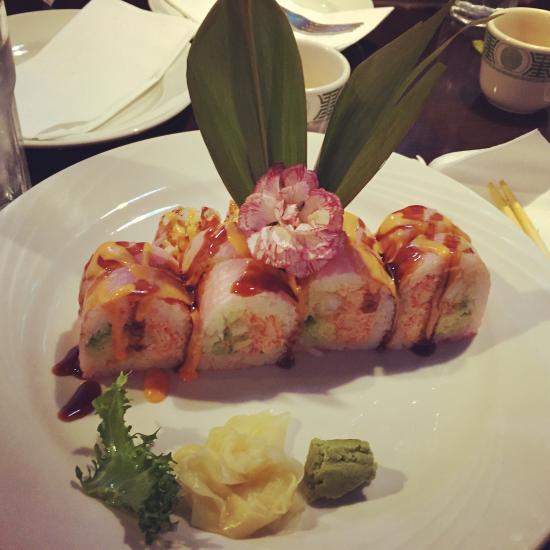
The width and height of the screenshot is (550, 550). Find the location of `fork`. fork is located at coordinates (306, 19).